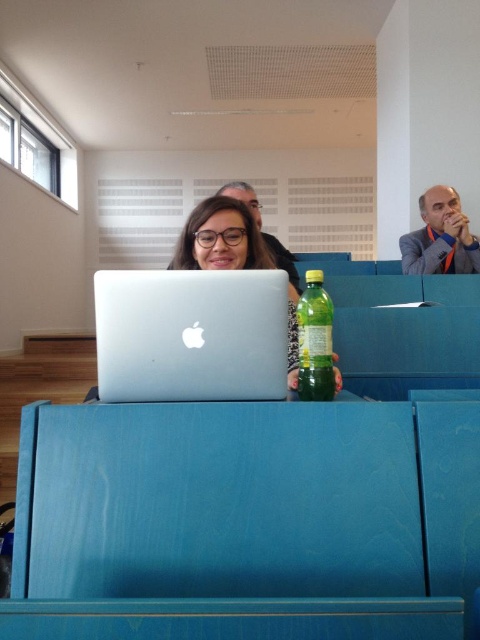
Which is behind, point (168, 320) or point (462, 244)?

The point (462, 244) is behind.

This screenshot has width=480, height=640. What are the coordinates of `sleek silver laptop at center` in the screenshot? It's located at (191, 333).

Who is positioned more to the left, matte black man at upper right or green translucent bottle at center?

green translucent bottle at center

Between point (418, 253) and point (325, 333), which one is positioned in front?

Point (325, 333) is more forward.

Where is `matte black man at upper right`? matte black man at upper right is located at coordinates (440, 237).

Who is more distant from viewer, (256,230) or (299,380)?

The point (256,230) is behind.

Which is more to the right, matte silver laptop at center or green translucent bottle at center?

Positioned to the right is green translucent bottle at center.

Between point (203, 240) and point (313, 317), which one is positioned in front?

Positioned in front is point (313, 317).

This screenshot has width=480, height=640. Find the location of `matte silver laptop at center`. matte silver laptop at center is located at coordinates (220, 237).